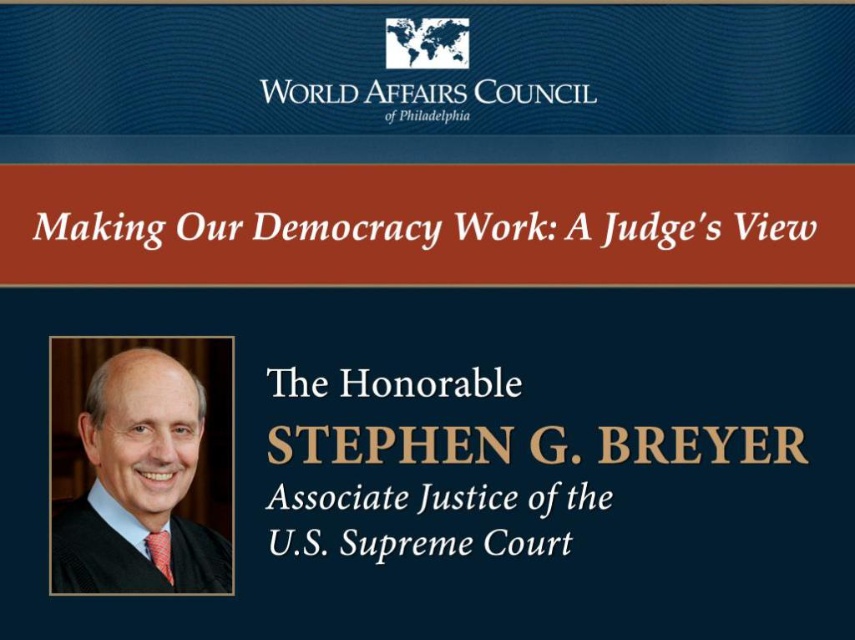
Question: Which point is closer to the camera taking this photo?

Choices:
 (A) (151, 561)
 (B) (534, 509)
 (C) (198, 566)
 (D) (292, 388)

Answer: (A)

Question: Does white paper text at center appear under white paper at upper center?

Choices:
 (A) yes
 (B) no

Answer: (A)

Question: Can you confirm if black robe at left is positioned below white paper at upper center?

Choices:
 (A) yes
 (B) no

Answer: (A)

Question: Which point is closer to the camera?

Choices:
 (A) (498, 369)
 (B) (390, 227)
 (C) (90, 561)
 (D) (160, 570)

Answer: (D)

Question: Does black robe at left have a larger size compared to white paper text at center?

Choices:
 (A) yes
 (B) no

Answer: (A)

Question: Which point is farther from the camera taking this photo?

Choices:
 (A) (340, 392)
 (B) (339, 545)
 (C) (81, 540)

Answer: (A)